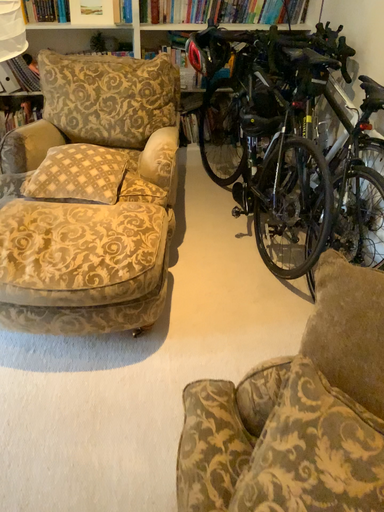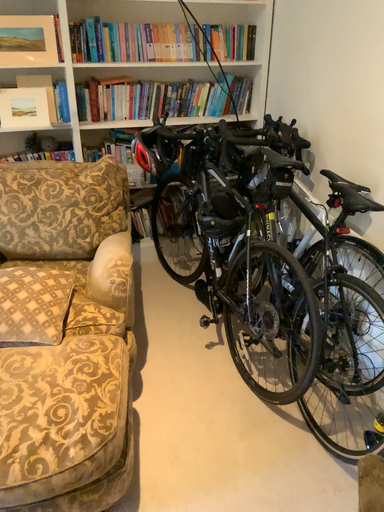
Question: Which way did the camera rotate in the video?

Choices:
 (A) rotated downward
 (B) rotated upward

Answer: (B)